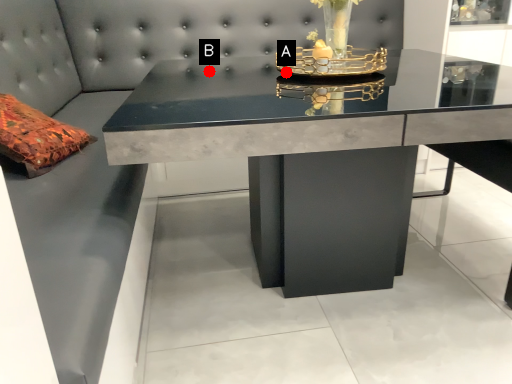
Question: Two points are circled on the image, labeled by A and B beside each circle. Which point appears farthest from the camera in this image?

Choices:
 (A) A is further
 (B) B is further

Answer: (B)